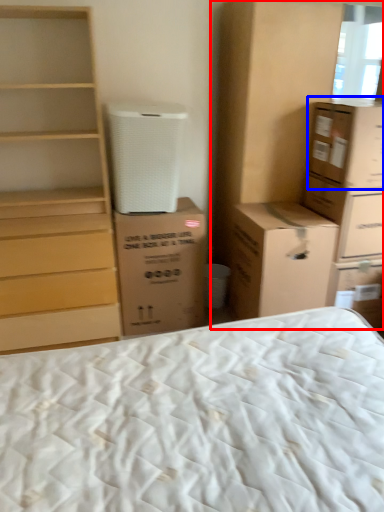
Question: Which object appears closest to the camera in this image, cabinetry (highlighted by a red box) or cardboard box (highlighted by a blue box)?

Choices:
 (A) cabinetry
 (B) cardboard box

Answer: (B)